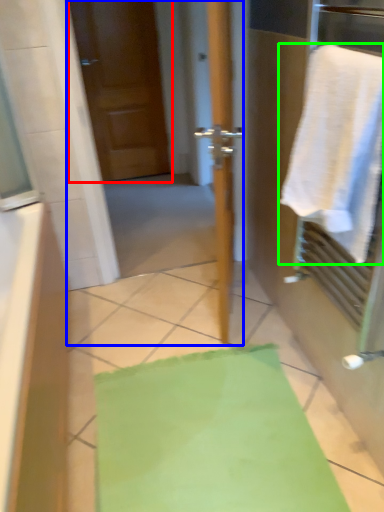
Question: Considering the real-world distances, which object is farthest from door (highlighted by a red box)? screen door (highlighted by a blue box) or towel (highlighted by a green box)?

Choices:
 (A) screen door
 (B) towel

Answer: (B)